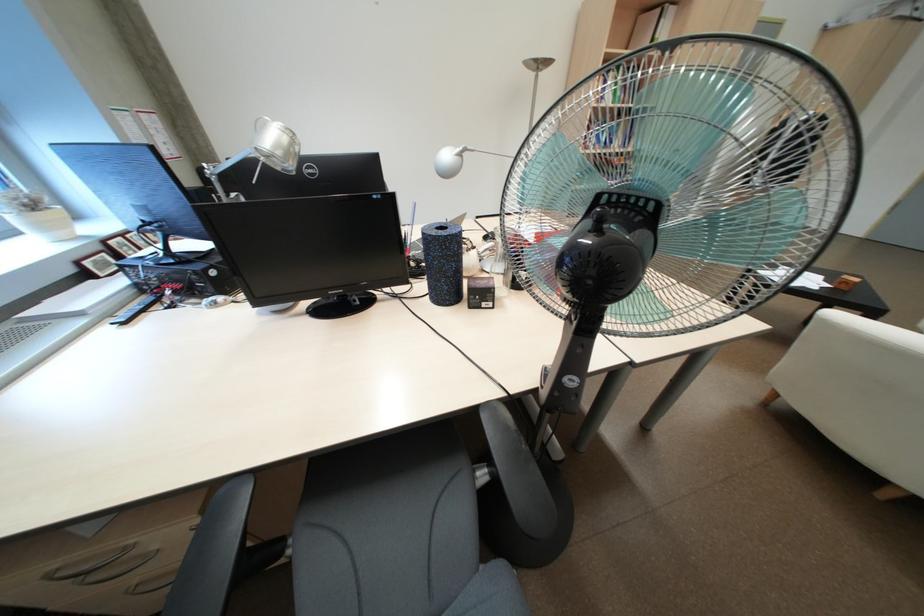
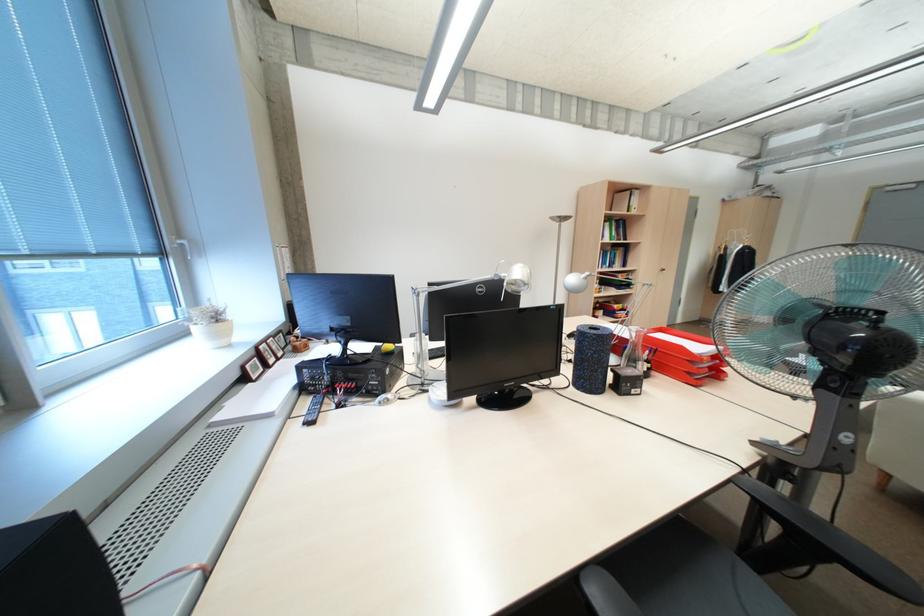
The point at [289,168] is marked in the first image. Where is the corresponding point in the second image?

(519, 290)